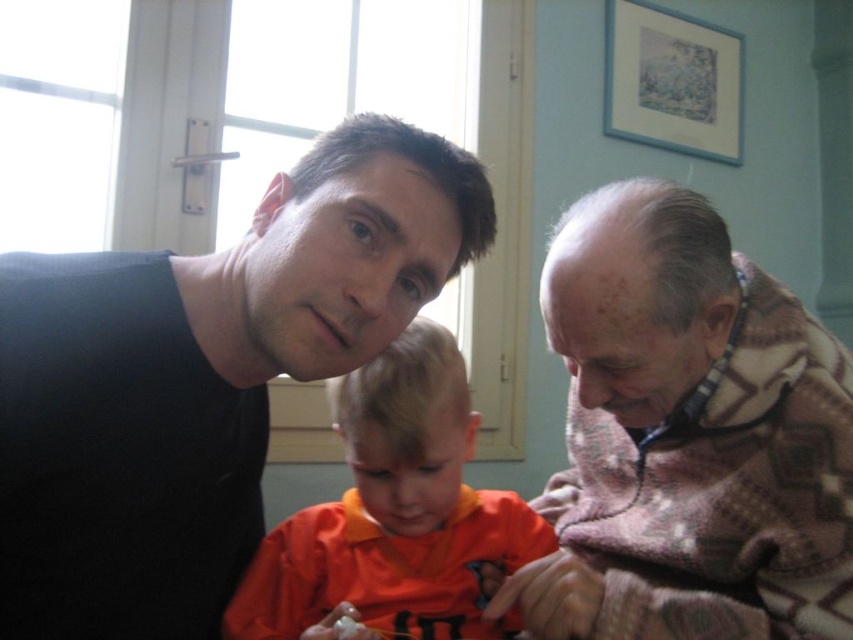
Question: Can you confirm if knitted sweater at right is positioned below orange fabric shirt at center?

Choices:
 (A) yes
 (B) no

Answer: (B)

Question: In this image, where is knitted sweater at right located relative to orange fabric shirt at center?

Choices:
 (A) right
 (B) left

Answer: (B)

Question: Is knitted wool sweater at right positioned in front of orange fabric shirt at center?

Choices:
 (A) yes
 (B) no

Answer: (A)

Question: Which of the following is the closest to the observer?

Choices:
 (A) (318, 593)
 (B) (618, 308)

Answer: (B)

Question: Which of these objects is positioned farthest from the knitted sweater at right?

Choices:
 (A) knitted wool sweater at right
 (B) orange fabric shirt at center

Answer: (A)

Question: Among these points, which one is farthest from the camera?

Choices:
 (A) (637, 548)
 (B) (206, 406)

Answer: (A)